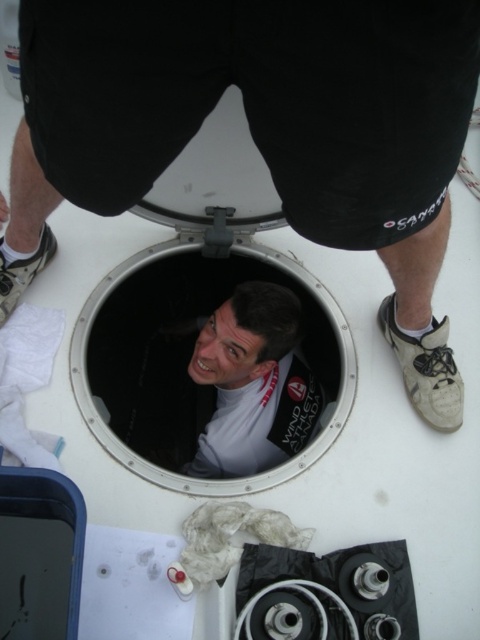
You are standing on the deck of a boat and see the white metallic porthole at center and the white matte shirt at center. Which object is positioned higher relative to the other?

The white metallic porthole at center is located above the white matte shirt at center, so it is positioned higher.

You are standing on the deck of a boat and see the white matte face at center and the white matte shirt at center. Which object is nearer to you?

The white matte face at center is closer to the viewer than the white matte shirt at center.